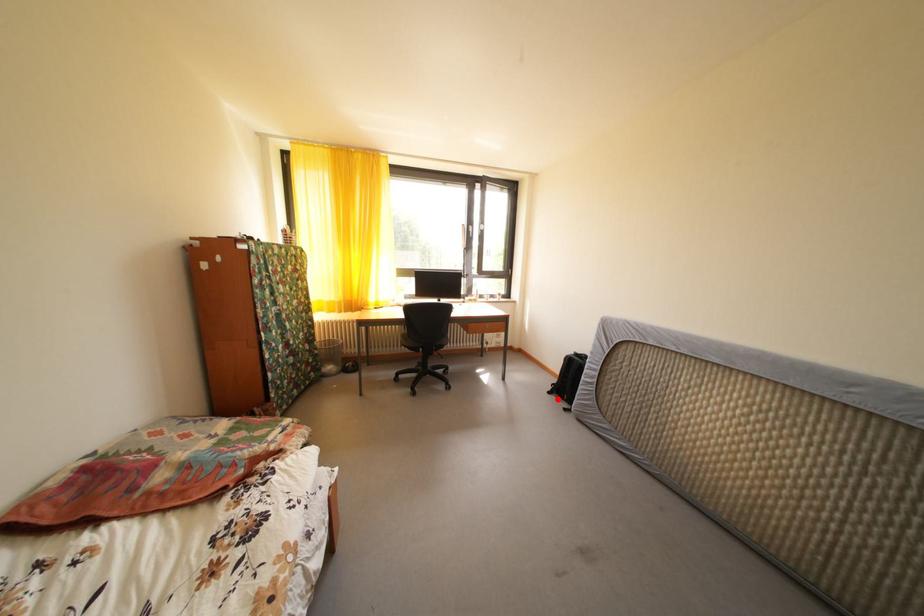
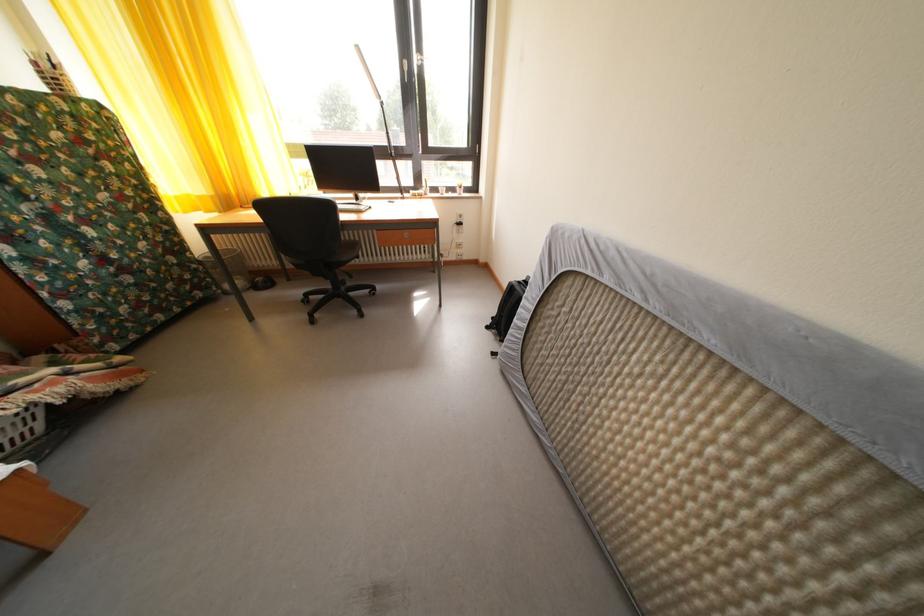
Question: I am providing you with two images of the same scene from different viewpoints. In image1, a red point is highlighted. Considering the same 3D point in image2, which of the following is correct?

Choices:
 (A) It is closer
 (B) It is farther

Answer: (B)